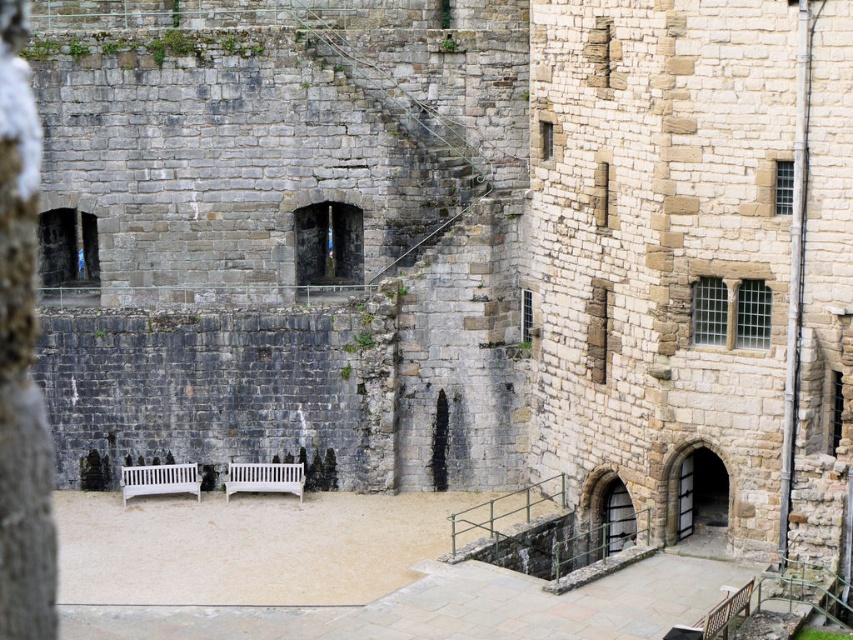
Does white wooden bench at lower left have a greater width compared to white wooden bench at center?

Incorrect, white wooden bench at lower left's width does not surpass white wooden bench at center's.

Who is taller, white wooden bench at lower left or white wooden bench at center?

white wooden bench at lower left is taller.

The width and height of the screenshot is (853, 640). Find the location of `white wooden bench at lower left`. white wooden bench at lower left is located at coordinates tap(160, 480).

Locate an element on the screen. The image size is (853, 640). white wooden bench at lower left is located at coordinates (160, 480).